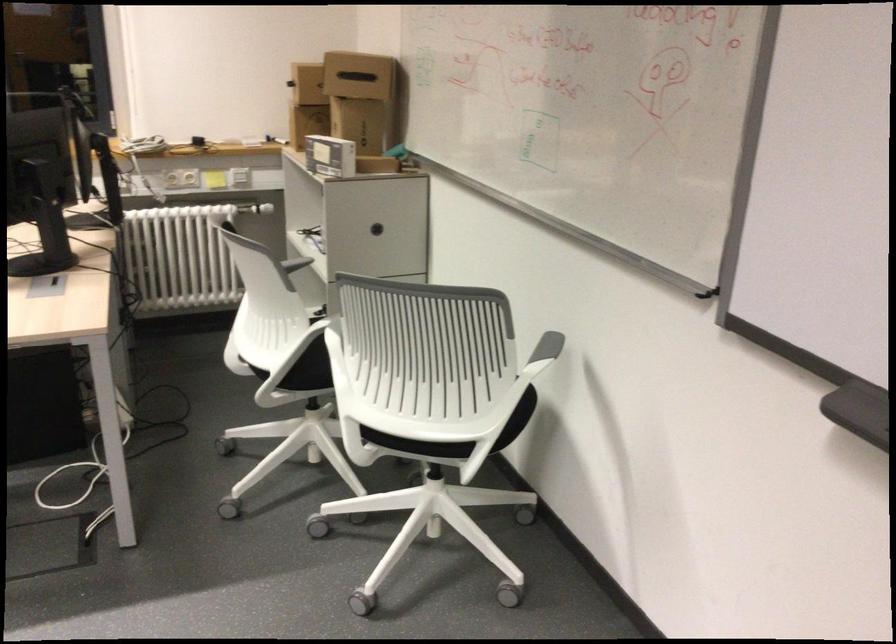
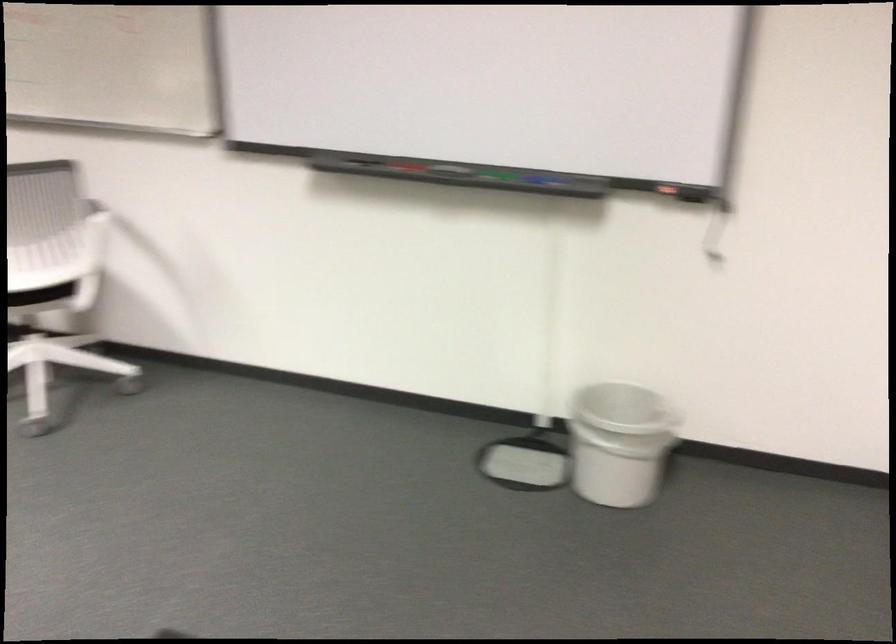
The point at [435,440] is marked in the first image. Where is the corresponding point in the second image?

(40, 295)